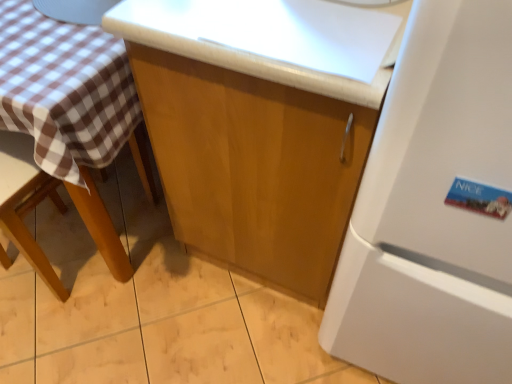
Question: In terms of width, does white matte refrigerator at right look wider or thinner when compared to brown wooden chair at left?

Choices:
 (A) thin
 (B) wide

Answer: (B)

Question: Considering the relative positions of white matte refrigerator at right and brown wooden chair at left in the image provided, is white matte refrigerator at right to the left or to the right of brown wooden chair at left?

Choices:
 (A) right
 (B) left

Answer: (A)

Question: Estimate the real-world distances between objects in this image. Which object is farther from the white matte refrigerator at right?

Choices:
 (A) brown wooden chair at left
 (B) glossy wood cabinet at center

Answer: (A)

Question: Considering the real-world distances, which object is closest to the white matte refrigerator at right?

Choices:
 (A) brown wooden chair at left
 (B) glossy wood cabinet at center

Answer: (B)